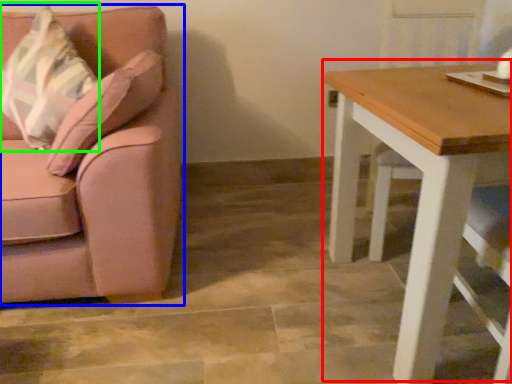
Question: Which object is the closest to the table (highlighted by a red box)? Choose among these: chair (highlighted by a blue box) or throw pillow (highlighted by a green box).

Choices:
 (A) chair
 (B) throw pillow

Answer: (A)